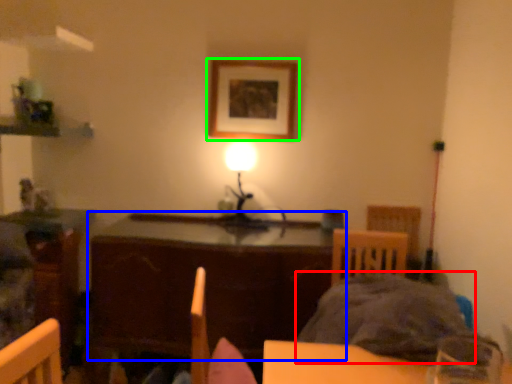
Question: Estimate the real-world distances between objects in this image. Which object is farther from bedding (highlighted by a red box), table (highlighted by a blue box) or picture frame (highlighted by a green box)?

Choices:
 (A) table
 (B) picture frame

Answer: (B)